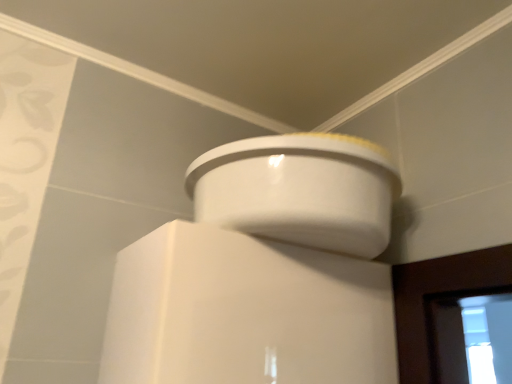
Image resolution: width=512 pixels, height=384 pixels. I want to click on white glossy toilet at upper center, so click(x=298, y=190).

What do you see at coordinates (298, 190) in the screenshot?
I see `white glossy toilet at upper center` at bounding box center [298, 190].

Where is `white glossy toilet at upper center`? The width and height of the screenshot is (512, 384). white glossy toilet at upper center is located at coordinates (298, 190).